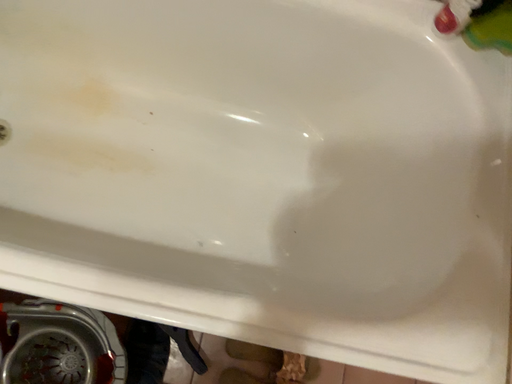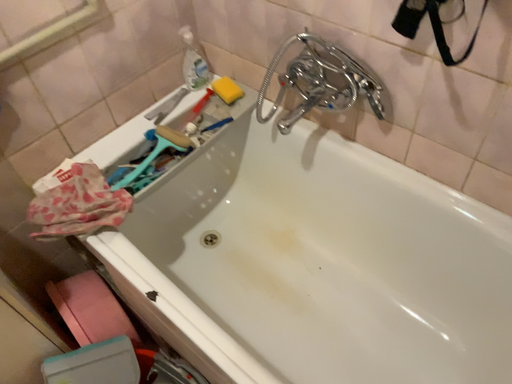
Question: How did the camera likely rotate when shooting the video?

Choices:
 (A) rotated downward
 (B) rotated upward

Answer: (B)